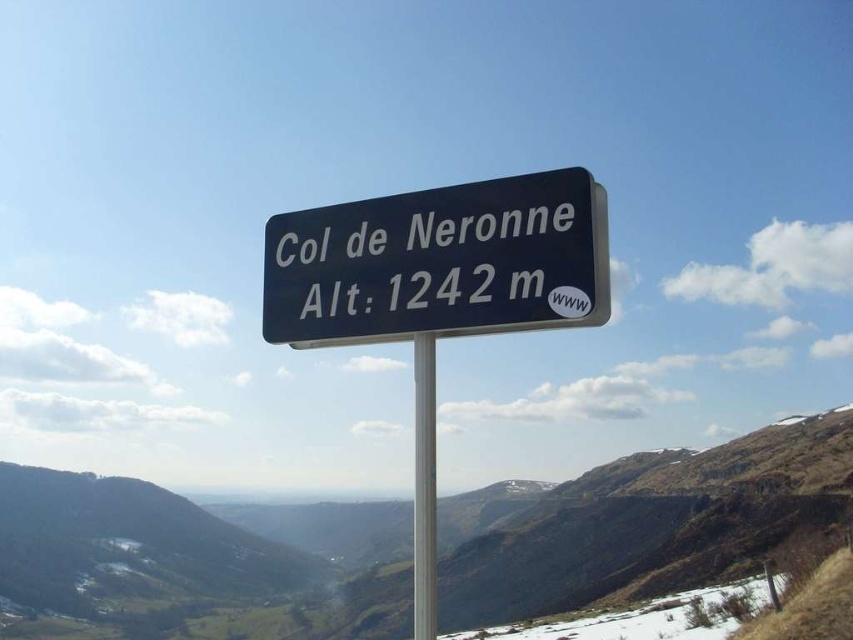
Does point (730, 566) lie in front of point (517, 176)?

No.

Which is more to the left, green grassy mountain at center or black plastic sign at center?

From the viewer's perspective, green grassy mountain at center appears more on the left side.

Which is in front, point (198, 560) or point (271, 340)?

Point (271, 340) is in front.

Where is `green grassy mountain at center`? Image resolution: width=853 pixels, height=640 pixels. green grassy mountain at center is located at coordinates (193, 564).

Does point (161, 595) come closer to viewer compared to point (424, 454)?

No, (161, 595) is further to viewer.

Locate an element on the screen. green grassy mountain at center is located at coordinates (193, 564).

Is point (346, 240) positioned before point (416, 568)?

No, it is not.

Where is `black plastic sign at center`? black plastic sign at center is located at coordinates (440, 262).